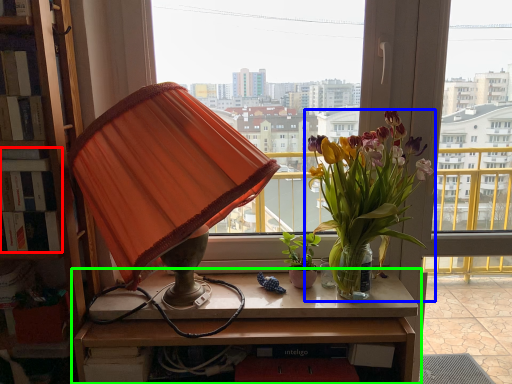
Question: Which is nearer to the book (highlighted by a red box)? houseplant (highlighted by a blue box) or table (highlighted by a green box).

Choices:
 (A) houseplant
 (B) table

Answer: (B)